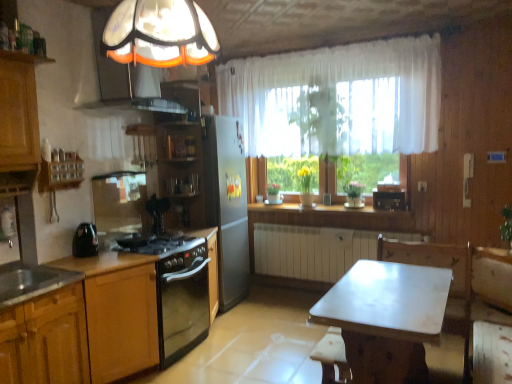
This screenshot has height=384, width=512. I want to click on empty space that is ontop of black plastic radio at center, the second appliance viewed from the left (from a real-world perspective), so click(389, 189).